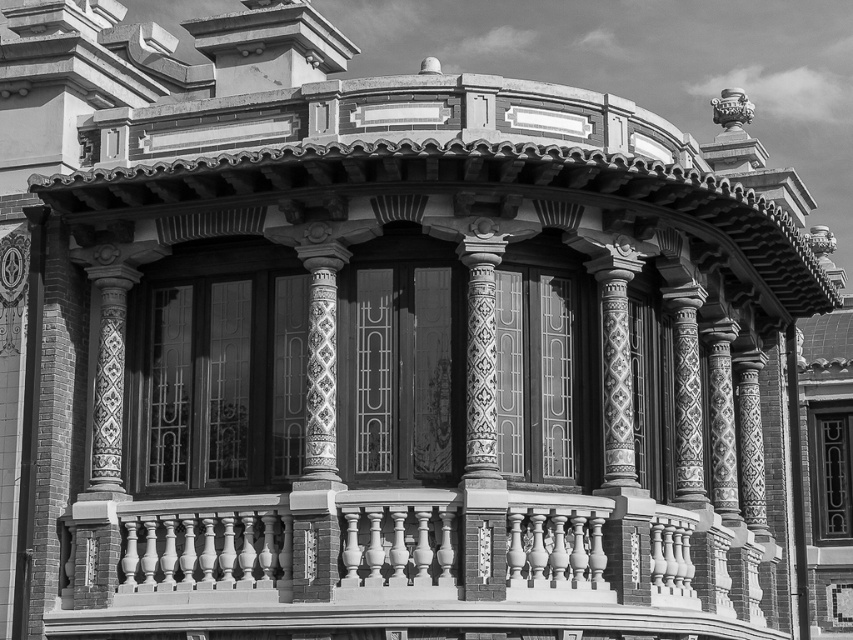
Is smooth white balustrade at lower center wider than decorative tile column at center?

Indeed, smooth white balustrade at lower center has a greater width compared to decorative tile column at center.

Can you confirm if smooth white balustrade at lower center is positioned to the left of decorative tile column at center?

Incorrect, smooth white balustrade at lower center is not on the left side of decorative tile column at center.

Identify the location of smooth white balustrade at lower center. (401, 564).